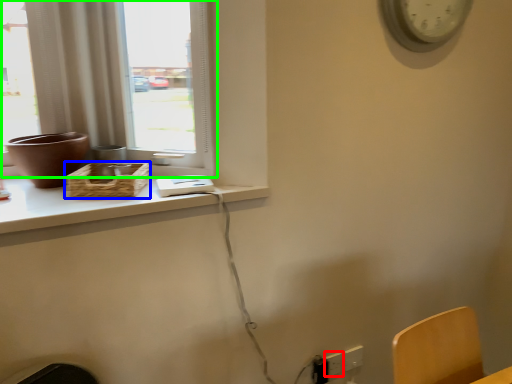
Question: Estimate the real-world distances between objects in this image. Which object is farther from electric outlet (highlighted by a red box), basket (highlighted by a blue box) or window (highlighted by a green box)?

Choices:
 (A) basket
 (B) window

Answer: (B)